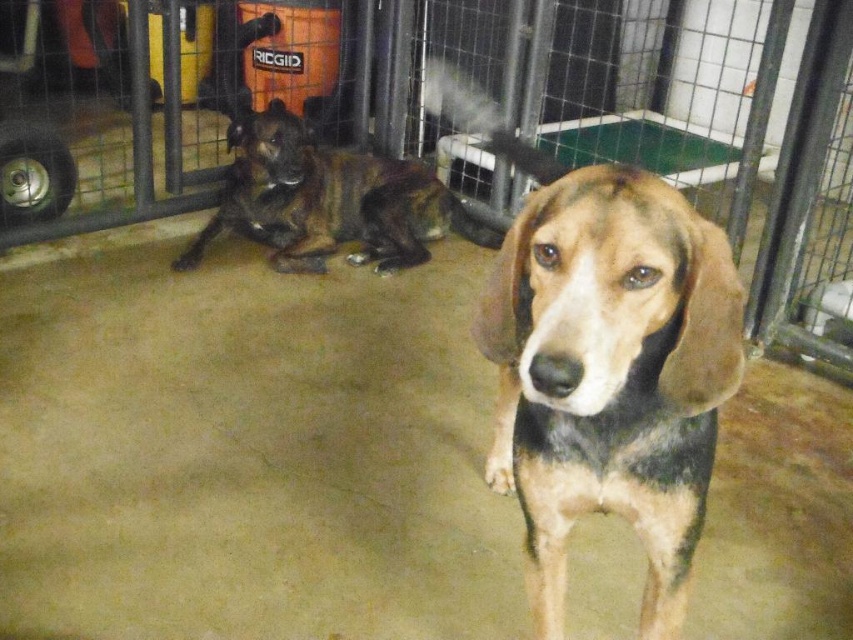
Can you confirm if metal wire fence at center is positioned to the right of tri-colored fur dog at center?

Incorrect, metal wire fence at center is not on the right side of tri-colored fur dog at center.

Who is lower down, metal wire fence at center or tri-colored fur dog at center?

tri-colored fur dog at center is lower down.

Does point (581, 124) lie behind point (549, 483)?

Yes.

Image resolution: width=853 pixels, height=640 pixels. I want to click on metal wire fence at center, so click(450, 115).

Consider the image. Does tri-colored fur dog at center appear over brown brindle dog at left?

No.

Locate an element on the screen. Image resolution: width=853 pixels, height=640 pixels. tri-colored fur dog at center is located at coordinates (608, 371).

Find the location of a particular element. The height and width of the screenshot is (640, 853). tri-colored fur dog at center is located at coordinates (608, 371).

Between metal wire fence at center and brown brindle dog at left, which one has more height?

With more height is metal wire fence at center.

Can you confirm if metal wire fence at center is positioned to the right of brown brindle dog at left?

Yes, metal wire fence at center is to the right of brown brindle dog at left.

Identify the location of metal wire fence at center. This screenshot has height=640, width=853. (450, 115).